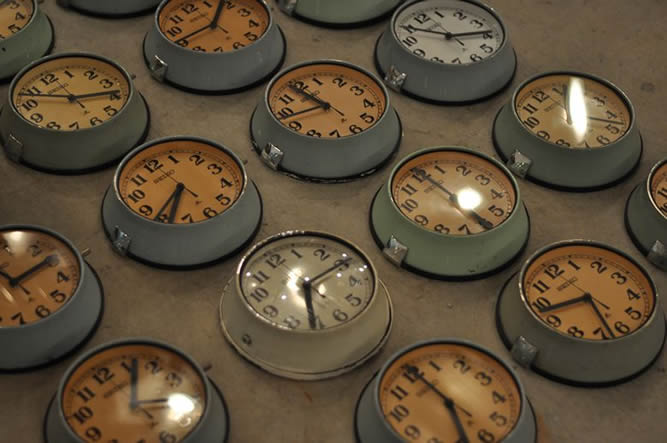
I want to click on clock 8, so click(221, 176).